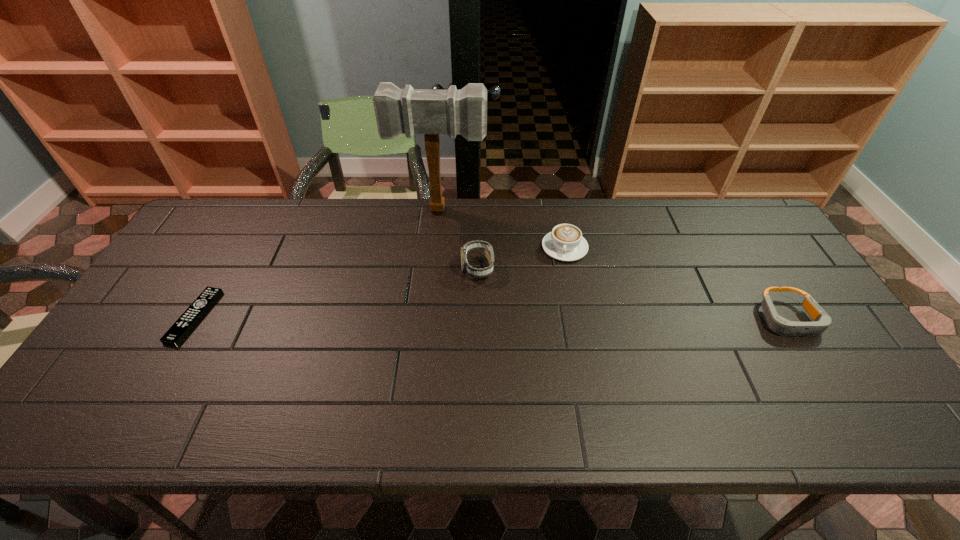
In order to click on mallet that is positioned at the far edge in this screenshot , I will do `click(431, 112)`.

You are a GUI agent. You are given a task and a screenshot of the screen. Output one action in this format:
    pyautogui.click(x=<x>, y=<y>)
    Task: Click on the cappuccino that is at the far edge
    The height and width of the screenshot is (540, 960).
    Given the screenshot: What is the action you would take?
    (x=565, y=243)

You are a GUI agent. You are given a task and a screenshot of the screen. Output one action in this format:
    pyautogui.click(x=<x>, y=<y>)
    Task: Click on the object located in the left edge section of the desktop
    Image resolution: width=960 pixels, height=540 pixels.
    Given the screenshot: What is the action you would take?
    pyautogui.click(x=188, y=320)

You are a GUI agent. You are given a task and a screenshot of the screen. Output one action in this format:
    pyautogui.click(x=<x>, y=<y>)
    Task: Click on the object that is positioned at the right edge
    This screenshot has width=960, height=540.
    Given the screenshot: What is the action you would take?
    pyautogui.click(x=779, y=325)

The image size is (960, 540). I want to click on vacant area at the far edge of the desktop, so click(546, 224).

In the image, there is a desktop. At what (x,y) coordinates should I click in order to perform the action: click on vacant space at the near edge. Please return your answer as a coordinate pair (x, y). Looking at the image, I should click on (420, 383).

Identify the location of free space at the right edge of the desktop. The width and height of the screenshot is (960, 540). (797, 300).

I want to click on vacant region at the far left corner of the desktop, so click(x=214, y=215).

This screenshot has width=960, height=540. Identify the location of free region at the near right corner. (829, 372).

The image size is (960, 540). I want to click on empty location between the tallest object and the watch, so click(x=459, y=239).